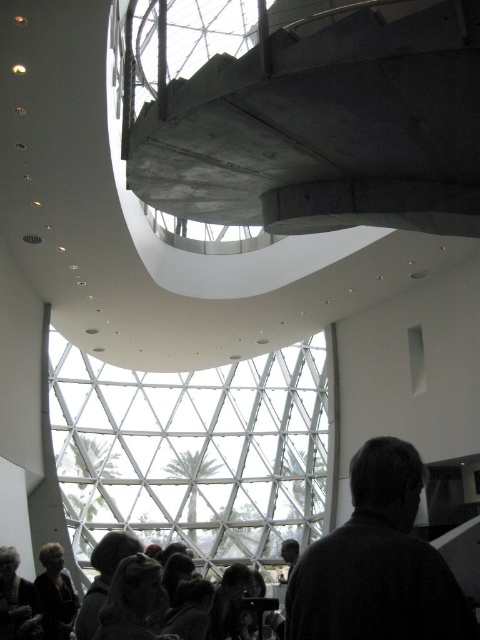
You are standing in the modern interior space and notice a person with dark brown hair at lower center. Where exactly is this person positioned in relation to the curved staircase?

The dark brown hair at lower center is located at point 0.964 on the x coordinate and 0.544 on the y coordinate, meaning it is positioned near the bottom right of the image, below the curved staircase.

In the scene described, there are two dark gray items present. The first is a dark gray sweater at lower right, and the second is a dark gray hair at lower left. From the perspective of an observer standing in the room, which of these two dark gray items is positioned to the right of the other?

The dark gray sweater at lower right is positioned to the right of the dark gray hair at lower left.